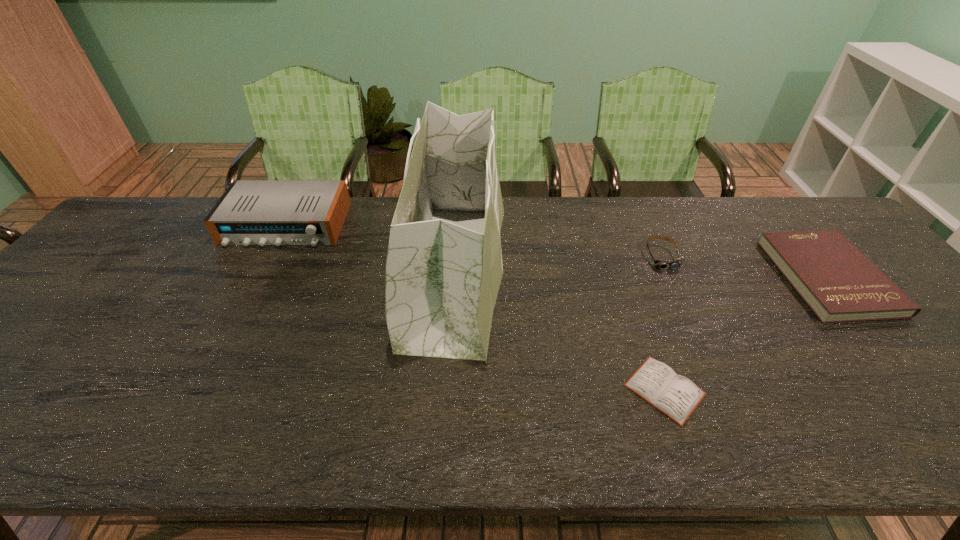
Identify the location of grocery bag. This screenshot has height=540, width=960. (442, 280).

This screenshot has height=540, width=960. In order to click on the second object from left to right in this screenshot , I will do `click(442, 280)`.

The image size is (960, 540). In order to click on the second tallest object in this screenshot , I will do `click(250, 212)`.

Identify the location of the leftmost object. (250, 212).

The width and height of the screenshot is (960, 540). What are the coordinates of `goggles` in the screenshot? It's located at (677, 263).

Where is `hardback book`? This screenshot has width=960, height=540. hardback book is located at coordinates (839, 283).

Where is `diary`? This screenshot has width=960, height=540. diary is located at coordinates (676, 396).

The height and width of the screenshot is (540, 960). I want to click on vacant space located on the right of the tallest object, so click(x=574, y=272).

Locate an element on the screen. The width and height of the screenshot is (960, 540). vacant area situated 0.390m on the control panel of the radio receiver is located at coordinates (216, 360).

Identify the location of vacant space located on the front-facing side of the goggles. (701, 342).